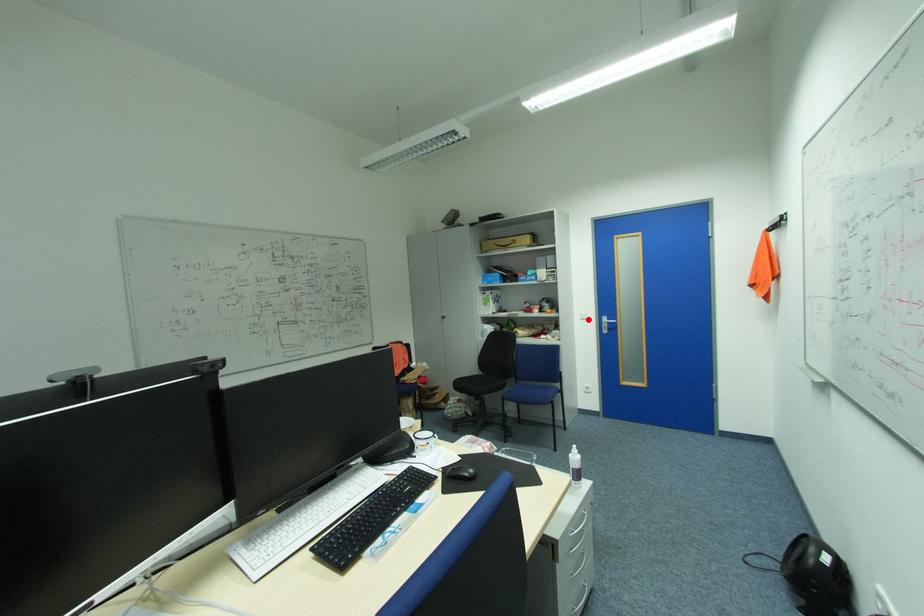
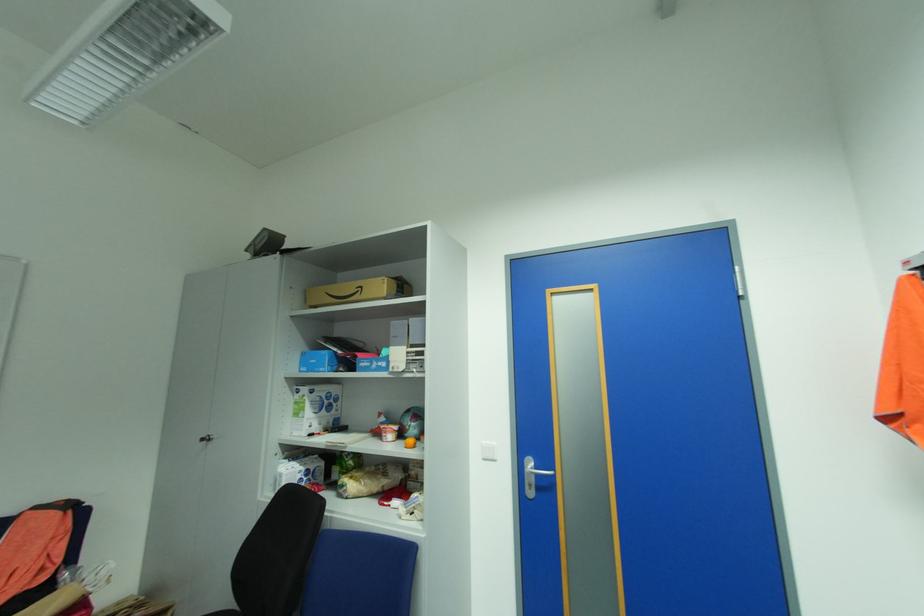
Locate, in the second image, the point that corresponds to the highlighted location in the first image.

(492, 460)